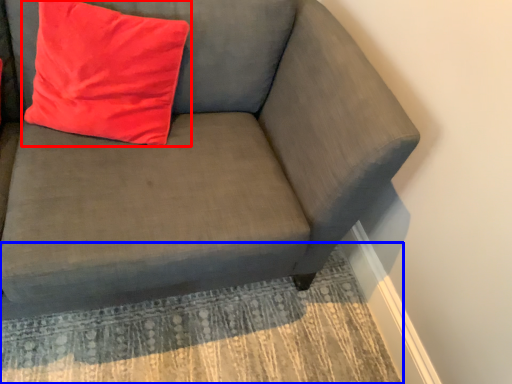
Question: Which of the following is the farthest to the observer, pillow (highlighted by a red box) or mat (highlighted by a blue box)?

Choices:
 (A) pillow
 (B) mat

Answer: (B)